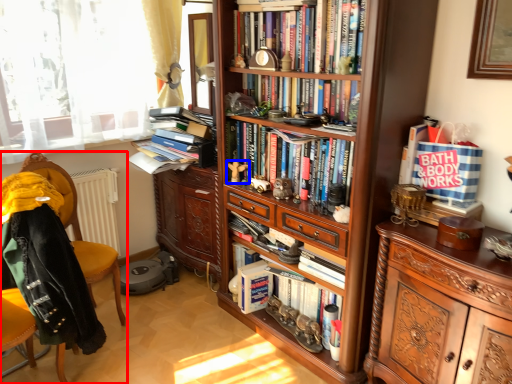
Question: Which object appears closest to the camera in this image, chair (highlighted by a red box) or toy (highlighted by a blue box)?

Choices:
 (A) chair
 (B) toy

Answer: (A)